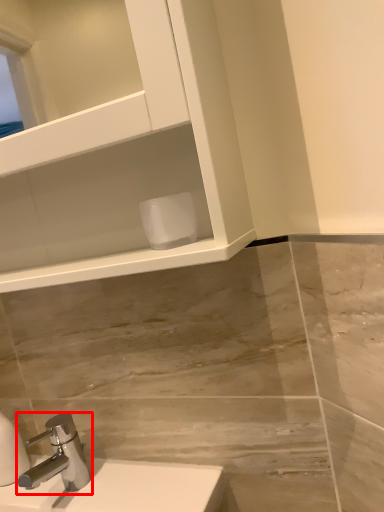
Question: From the image's perspective, where is tap (annotated by the red box) located in relation to toilet paper in the image?

Choices:
 (A) below
 (B) above

Answer: (A)